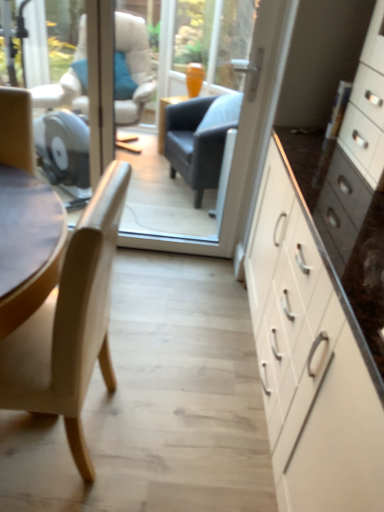
In order to face transparent glass door at center, should I rotate leftwards or rightwards?

Rotate your view left by about 7.945°.

The image size is (384, 512). Find the location of `transparent glass door at center`. transparent glass door at center is located at coordinates (225, 154).

Would you say light beige wood chair at left contains white glossy cabinet at right?

Definitely not — white glossy cabinet at right is not inside light beige wood chair at left.

Is light beige wood chair at left with white glossy cabinet at right?

No, light beige wood chair at left is not touching white glossy cabinet at right.

Where is `cabinetry above the light beige wood chair at left (from the image's perspective)`? This screenshot has height=512, width=384. cabinetry above the light beige wood chair at left (from the image's perspective) is located at coordinates (310, 358).

Does light beige wood chair at left have a greater height compared to white glossy cabinet at right?

No.

Is white glossy cabinet at right positioned behind transparent glass door at center?

No, white glossy cabinet at right is closer to the camera.

Could you tell me if white glossy cabinet at right is turned towards transparent glass door at center?

Yes.

Considering the relative positions of white glossy cabinet at right and transparent glass door at center in the image provided, is white glossy cabinet at right to the left or to the right of transparent glass door at center?

Based on their positions, white glossy cabinet at right is located to the right of transparent glass door at center.

Which point is more forward, (251, 109) or (91, 231)?

The point (91, 231) is closer.

Is transparent glass door at center thinner than light beige wood chair at left?

Correct, the width of transparent glass door at center is less than that of light beige wood chair at left.

Between transparent glass door at center and light beige wood chair at left, which one has smaller size?

Smaller between the two is transparent glass door at center.

Which of these two, transparent glass door at center or light beige wood chair at left, stands shorter?

light beige wood chair at left.

From a real-world perspective, which is physically above, white glossy cabinet at right or light beige wood chair at left?

From a 3D spatial view, white glossy cabinet at right is above.

Is white glossy cabinet at right shorter than light beige wood chair at left?

Incorrect, the height of white glossy cabinet at right does not fall short of that of light beige wood chair at left.

From the image's perspective, is white glossy cabinet at right located beneath light beige wood chair at left?

No.

Is light beige wood chair at left at the back of white glossy cabinet at right?

That's not correct — white glossy cabinet at right is not looking away from light beige wood chair at left.

Looking at this image, is transparent glass door at center wider or thinner than white glossy cabinet at right?

Clearly, transparent glass door at center has less width compared to white glossy cabinet at right.

Who is shorter, transparent glass door at center or white glossy cabinet at right?

transparent glass door at center is shorter.

This screenshot has height=512, width=384. What are the coordinates of `cabinetry in front of the transparent glass door at center` in the screenshot? It's located at (310, 358).

Does transparent glass door at center appear on the left side of white glossy cabinet at right?

Yes.

Considering the sizes of light beige wood chair at left and transparent glass door at center in the image, is light beige wood chair at left bigger or smaller than transparent glass door at center?

light beige wood chair at left is bigger than transparent glass door at center.

Which is further, (38,311) or (202,250)?

The point (202,250) is farther from the camera.

Could transparent glass door at center be considered to be inside light beige wood chair at left?

No, transparent glass door at center is located outside of light beige wood chair at left.

The image size is (384, 512). In order to click on chair on the left side of white glossy cabinet at right in this screenshot , I will do `click(70, 324)`.

Where is `cabinetry that is above the transparent glass door at center (from a real-world perspective)`? The width and height of the screenshot is (384, 512). cabinetry that is above the transparent glass door at center (from a real-world perspective) is located at coordinates tap(310, 358).

Which object lies nearer to the anchor point light beige wood chair at left, white glossy cabinet at right or transparent glass door at center?

white glossy cabinet at right.

From the picture: Considering their positions, is white glossy cabinet at right positioned closer to transparent glass door at center than light beige wood chair at left?

Among the two, white glossy cabinet at right is located nearer to transparent glass door at center.

From the image, which object appears to be nearer to white glossy cabinet at right, light beige wood chair at left or transparent glass door at center?

light beige wood chair at left is closer to white glossy cabinet at right.

Considering their positions, is transparent glass door at center positioned closer to light beige wood chair at left than white glossy cabinet at right?

white glossy cabinet at right.

Based on their spatial positions, is transparent glass door at center or light beige wood chair at left further from white glossy cabinet at right?

transparent glass door at center is positioned further to the anchor white glossy cabinet at right.

When comparing their distances from transparent glass door at center, does light beige wood chair at left or white glossy cabinet at right seem closer?

white glossy cabinet at right is positioned closer to the anchor transparent glass door at center.

Where is `chair between white glossy cabinet at right and transparent glass door at center from front to back`? Image resolution: width=384 pixels, height=512 pixels. chair between white glossy cabinet at right and transparent glass door at center from front to back is located at coordinates (70, 324).